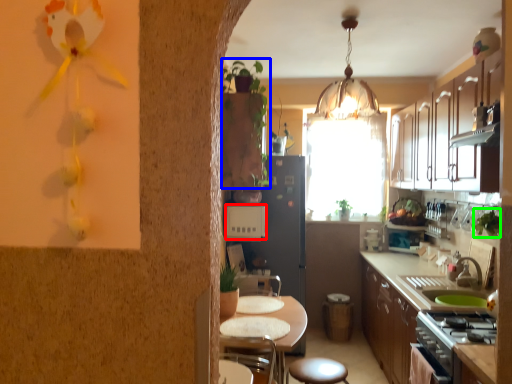
Question: Which is farther away from appliance (highlighted by a red box)? plant (highlighted by a blue box) or plant (highlighted by a green box)?

Choices:
 (A) plant
 (B) plant

Answer: (B)